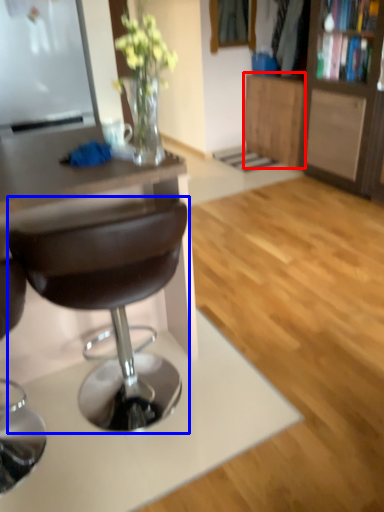
Question: Which object is further to the camera taking this photo, cabinetry (highlighted by a red box) or chair (highlighted by a blue box)?

Choices:
 (A) cabinetry
 (B) chair

Answer: (A)